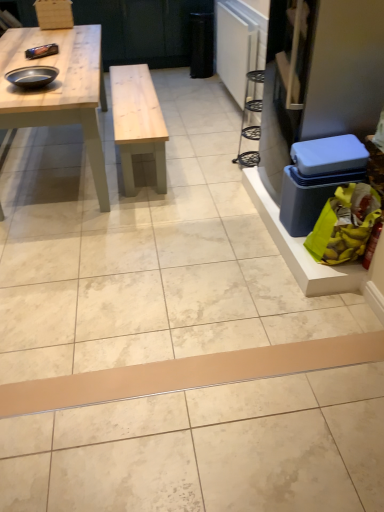
Where is `vacant space underneath light wood table at upper left (from a real-world perspective)`? The height and width of the screenshot is (512, 384). vacant space underneath light wood table at upper left (from a real-world perspective) is located at coordinates (56, 169).